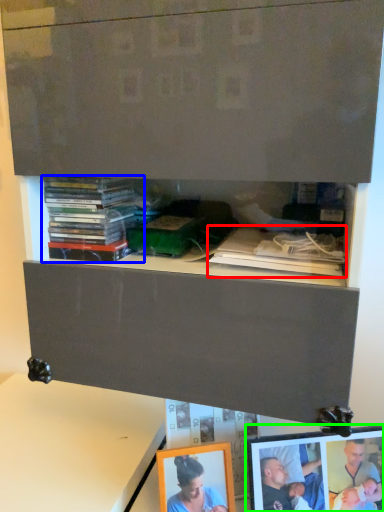
Question: Which object is the closest to the book (highlighted by a red box)? Choose among these: book (highlighted by a blue box) or picture frame (highlighted by a green box).

Choices:
 (A) book
 (B) picture frame

Answer: (A)